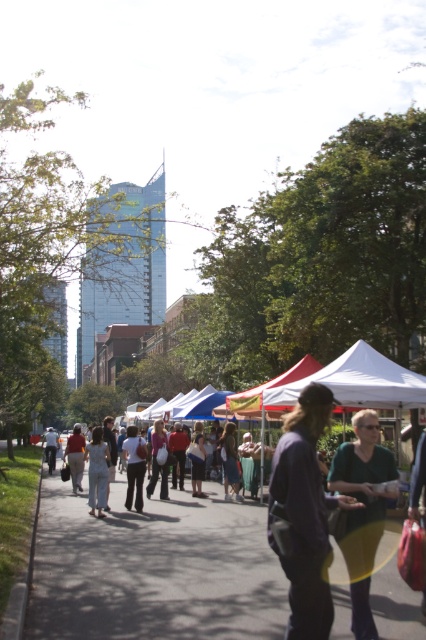
You are a photographer trying to capture both the white cotton shirt at center and the light blue denim dress at center in a single frame. Given their spatial arrangement, which one would you need to focus on more to ensure both are clearly visible?

The white cotton shirt at center occupies less space than the light blue denim dress at center, so you should focus on the light blue denim dress at center to ensure both are clearly visible.

You are standing in the outdoor market scene and want to take a photo. There are two points marked in the image. Which point, point (x=294, y=419) or point (x=135, y=500), is closer to you?

Point (x=294, y=419) is closer to you than point (x=135, y=500).